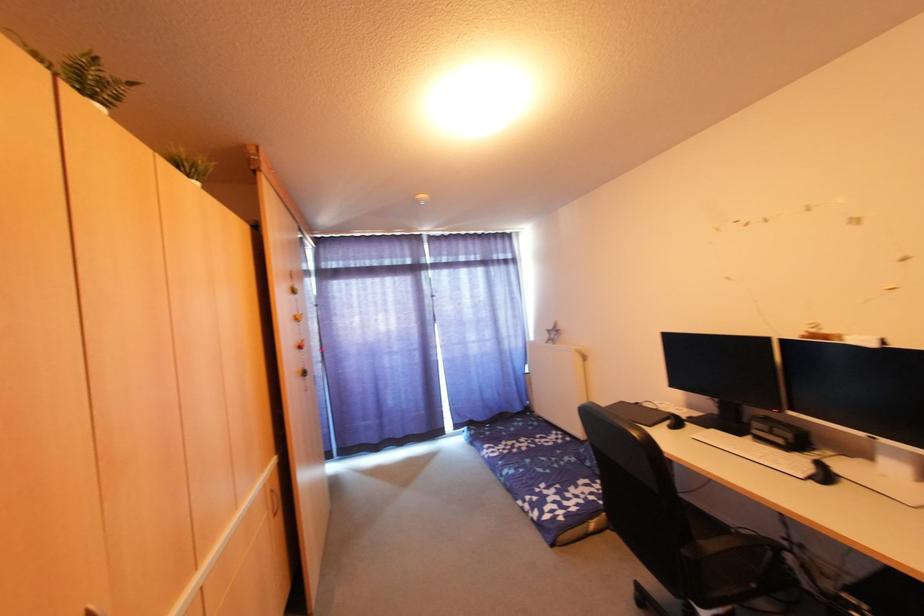
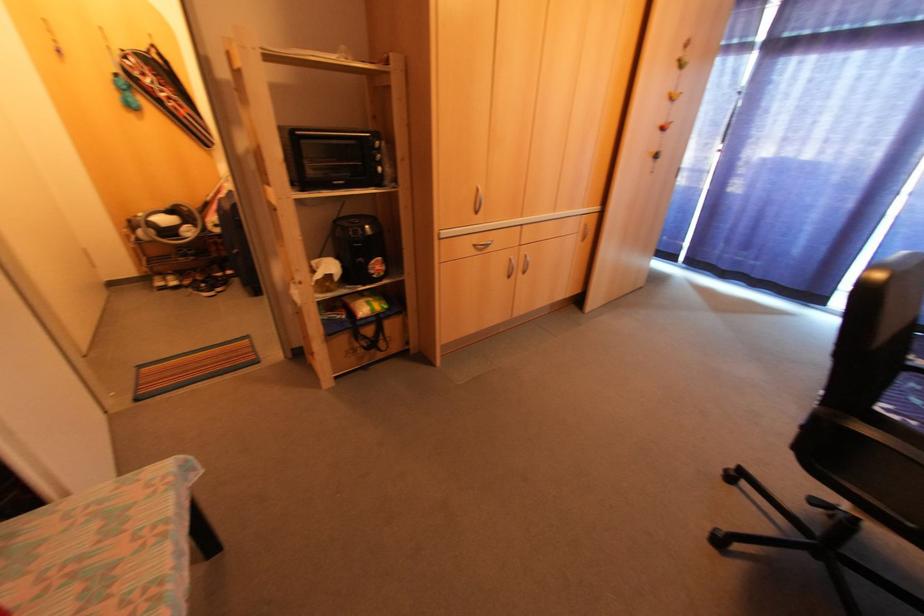
Locate, in the second image, the point that corresponds to pixel 553 485 in the first image.

(906, 419)